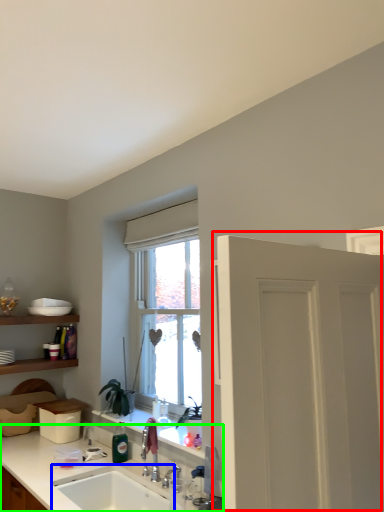
Question: Estimate the real-world distances between objects in this image. Which object is closer to door (highlighted by a red box), sink (highlighted by a blue box) or countertop (highlighted by a green box)?

Choices:
 (A) sink
 (B) countertop

Answer: (B)